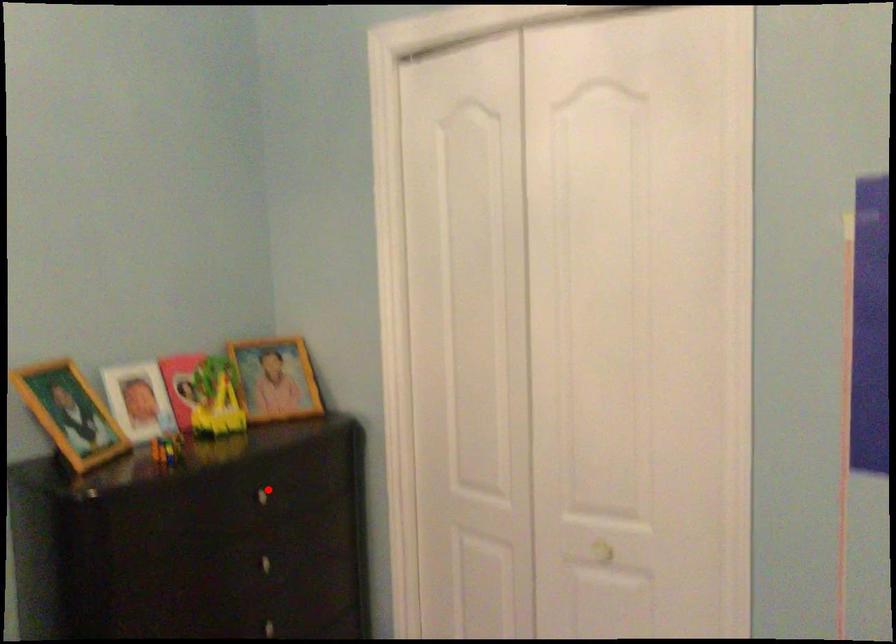
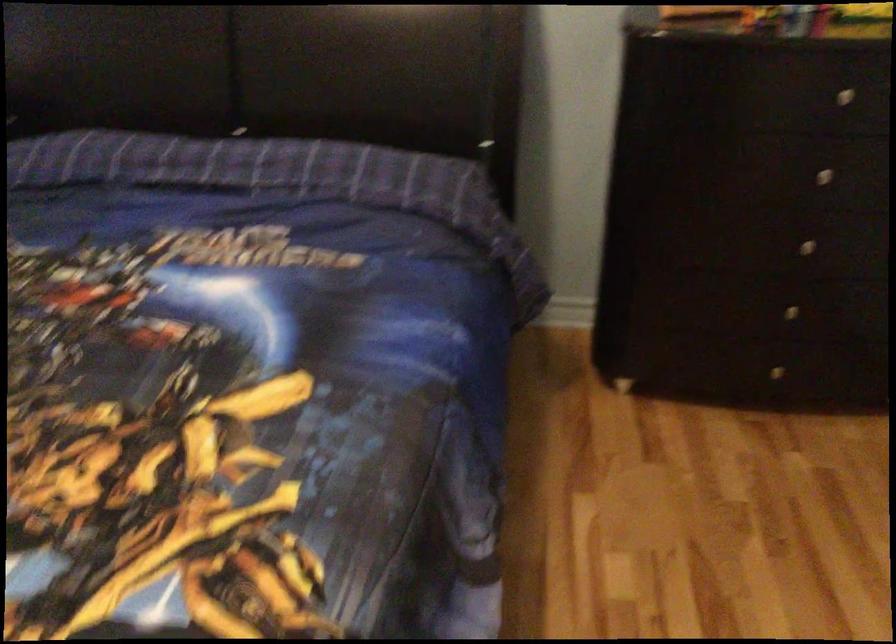
Question: I am providing you with two images of the same scene from different viewpoints. Image1 has a red point marked. In image2, the corresponding 3D location appears at what relative position? Reply with the corresponding letter.

Choices:
 (A) Closer
 (B) Farther

Answer: (A)